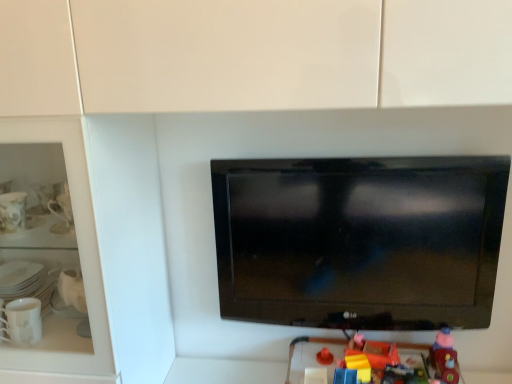
Image resolution: width=512 pixels, height=384 pixels. Describe the element at coordinates (444, 357) in the screenshot. I see `matte plastic toy at lower right, which is counted as the first toy, starting from the right` at that location.

At what (x,y) coordinates should I click in order to perform the action: click on black glossy tv at center. Please return your answer as a coordinate pair (x, y). Image resolution: width=512 pixels, height=384 pixels. Looking at the image, I should click on (360, 240).

From a real-world perspective, is matte plastic toy at lower right, the third toy in the left-to-right sequence, physically located above or below black glossy tv at center?

matte plastic toy at lower right, the third toy in the left-to-right sequence, is situated lower than black glossy tv at center in the real world.

Visually, is matte plastic toy at lower right, the third toy in the left-to-right sequence, positioned to the left or to the right of black glossy tv at center?

matte plastic toy at lower right, the third toy in the left-to-right sequence, is positioned on black glossy tv at center's right side.

Is matte plastic toy at lower right, which is counted as the first toy, starting from the right, facing towards black glossy tv at center?

No.

How different are the orientations of matte plastic toy at lower right, the third toy in the left-to-right sequence, and black glossy tv at center in degrees?

They differ by 0.878 degrees in their facing directions.

Looking at this image, can you confirm if matte plastic toy at lower right, the third toy in the left-to-right sequence, is thinner than rubberized plastic toy at lower right, acting as the 3th toy starting from the right?

Indeed, matte plastic toy at lower right, the third toy in the left-to-right sequence, has a lesser width compared to rubberized plastic toy at lower right, acting as the 3th toy starting from the right.

Is rubberized plastic toy at lower right, placed as the 1th toy when sorted from left to right, surrounded by matte plastic toy at lower right, the third toy in the left-to-right sequence?

No, rubberized plastic toy at lower right, placed as the 1th toy when sorted from left to right, is not a part of matte plastic toy at lower right, the third toy in the left-to-right sequence.

Who is bigger, matte plastic toy at lower right, which is counted as the first toy, starting from the right, or rubberized plastic toy at lower right, placed as the 1th toy when sorted from left to right?

rubberized plastic toy at lower right, placed as the 1th toy when sorted from left to right.

Locate an element on the screen. The height and width of the screenshot is (384, 512). television that is on the left side of rubberized plastic toy at lower right, placed as the 1th toy when sorted from left to right is located at coordinates (360, 240).

Which of these two, rubberized plastic toy at lower right, placed as the 1th toy when sorted from left to right, or black glossy tv at center, is smaller?

rubberized plastic toy at lower right, placed as the 1th toy when sorted from left to right.

Can you confirm if rubberized plastic toy at lower right, acting as the 3th toy starting from the right, is thinner than black glossy tv at center?

No, rubberized plastic toy at lower right, acting as the 3th toy starting from the right, is not thinner than black glossy tv at center.

Between rubberized plastic toy at lower right, placed as the 1th toy when sorted from left to right, and black glossy tv at center, which one has less height?

With less height is rubberized plastic toy at lower right, placed as the 1th toy when sorted from left to right.

Could you tell me if black glossy tv at center is turned towards rubberized plastic toy at lower right, acting as the 3th toy starting from the right?

No, black glossy tv at center does not turn towards rubberized plastic toy at lower right, acting as the 3th toy starting from the right.

Considering the relative sizes of black glossy tv at center and rubberized plastic toy at lower right, placed as the 1th toy when sorted from left to right, in the image provided, is black glossy tv at center taller than rubberized plastic toy at lower right, placed as the 1th toy when sorted from left to right,?

Yes, black glossy tv at center is taller than rubberized plastic toy at lower right, placed as the 1th toy when sorted from left to right.

Image resolution: width=512 pixels, height=384 pixels. Identify the location of the 3rd toy directly beneath the black glossy tv at center (from a real-world perspective). (387, 359).

Looking at this image, considering the relative positions of black glossy tv at center and rubberized plastic toy at lower right, acting as the 3th toy starting from the right, in the image provided, is black glossy tv at center to the right of rubberized plastic toy at lower right, acting as the 3th toy starting from the right, from the viewer's perspective?

No.

Is point (367, 382) farther from camera compared to point (448, 334)?

No, it is not.

Can you see rubberized plastic toy at lower center, which is the second toy in left-to-right order, touching matte plastic toy at lower right, the third toy in the left-to-right sequence?

No, rubberized plastic toy at lower center, which is the second toy in left-to-right order, is not with matte plastic toy at lower right, the third toy in the left-to-right sequence.

Is rubberized plastic toy at lower center, which is counted as the 2th toy, starting from the right, not inside matte plastic toy at lower right, which is counted as the first toy, starting from the right?

rubberized plastic toy at lower center, which is counted as the 2th toy, starting from the right, lies outside matte plastic toy at lower right, which is counted as the first toy, starting from the right,'s area.

Does rubberized plastic toy at lower center, which is the second toy in left-to-right order, lie behind matte plastic toy at lower right, which is counted as the first toy, starting from the right?

Yes, rubberized plastic toy at lower center, which is the second toy in left-to-right order, is further from the camera.

Does point (381, 353) come farther from viewer compared to point (360, 356)?

Yes, point (381, 353) is farther from viewer.

Can you confirm if rubberized plastic toy at lower center, which is counted as the 2th toy, starting from the right, is shorter than rubberized plastic toy at lower right, placed as the 1th toy when sorted from left to right?

Correct, rubberized plastic toy at lower center, which is counted as the 2th toy, starting from the right, is not as tall as rubberized plastic toy at lower right, placed as the 1th toy when sorted from left to right.

Considering the relative sizes of rubberized plastic toy at lower center, which is counted as the 2th toy, starting from the right, and rubberized plastic toy at lower right, acting as the 3th toy starting from the right, in the image provided, is rubberized plastic toy at lower center, which is counted as the 2th toy, starting from the right, thinner than rubberized plastic toy at lower right, acting as the 3th toy starting from the right,?

Indeed, rubberized plastic toy at lower center, which is counted as the 2th toy, starting from the right, has a lesser width compared to rubberized plastic toy at lower right, acting as the 3th toy starting from the right.

Is black glossy tv at center positioned far away from rubberized plastic toy at lower center, which is counted as the 2th toy, starting from the right?

black glossy tv at center is actually quite close to rubberized plastic toy at lower center, which is counted as the 2th toy, starting from the right.

Between black glossy tv at center and rubberized plastic toy at lower center, which is the second toy in left-to-right order, which one has less height?

rubberized plastic toy at lower center, which is the second toy in left-to-right order, is shorter.

Can you tell me how much black glossy tv at center and rubberized plastic toy at lower center, which is counted as the 2th toy, starting from the right, differ in facing direction?

The angular difference between black glossy tv at center and rubberized plastic toy at lower center, which is counted as the 2th toy, starting from the right, is 2.82 degrees.

Is black glossy tv at center oriented towards rubberized plastic toy at lower center, which is counted as the 2th toy, starting from the right?

No, black glossy tv at center is not facing towards rubberized plastic toy at lower center, which is counted as the 2th toy, starting from the right.

The width and height of the screenshot is (512, 384). Identify the location of television to the left of matte plastic toy at lower right, which is counted as the first toy, starting from the right. (360, 240).

Where is `toy located in front of the matte plastic toy at lower right, the third toy in the left-to-right sequence`? Image resolution: width=512 pixels, height=384 pixels. toy located in front of the matte plastic toy at lower right, the third toy in the left-to-right sequence is located at coordinates (387, 359).

Based on their spatial positions, is matte plastic toy at lower right, the third toy in the left-to-right sequence, or black glossy tv at center closer to rubberized plastic toy at lower right, placed as the 1th toy when sorted from left to right?

Based on the image, matte plastic toy at lower right, the third toy in the left-to-right sequence, appears to be nearer to rubberized plastic toy at lower right, placed as the 1th toy when sorted from left to right.

When comparing their distances from rubberized plastic toy at lower center, which is counted as the 2th toy, starting from the right, does black glossy tv at center or matte plastic toy at lower right, the third toy in the left-to-right sequence, seem further?

black glossy tv at center is further to rubberized plastic toy at lower center, which is counted as the 2th toy, starting from the right.

Considering their positions, is black glossy tv at center positioned closer to rubberized plastic toy at lower center, which is the second toy in left-to-right order, than rubberized plastic toy at lower right, placed as the 1th toy when sorted from left to right?

rubberized plastic toy at lower right, placed as the 1th toy when sorted from left to right, is closer to rubberized plastic toy at lower center, which is the second toy in left-to-right order.

Which object lies further to the anchor point rubberized plastic toy at lower right, placed as the 1th toy when sorted from left to right, rubberized plastic toy at lower center, which is counted as the 2th toy, starting from the right, or matte plastic toy at lower right, the third toy in the left-to-right sequence?

matte plastic toy at lower right, the third toy in the left-to-right sequence.

Which object lies further to the anchor point matte plastic toy at lower right, which is counted as the first toy, starting from the right, black glossy tv at center or rubberized plastic toy at lower right, placed as the 1th toy when sorted from left to right?

black glossy tv at center.

Based on the photo, when comparing their distances from matte plastic toy at lower right, which is counted as the first toy, starting from the right, does rubberized plastic toy at lower right, acting as the 3th toy starting from the right, or black glossy tv at center seem closer?

Among the two, rubberized plastic toy at lower right, acting as the 3th toy starting from the right, is located nearer to matte plastic toy at lower right, which is counted as the first toy, starting from the right.

Looking at the image, which one is located further to matte plastic toy at lower right, the third toy in the left-to-right sequence, rubberized plastic toy at lower right, acting as the 3th toy starting from the right, or rubberized plastic toy at lower center, which is counted as the 2th toy, starting from the right?

rubberized plastic toy at lower center, which is counted as the 2th toy, starting from the right.

Considering their positions, is matte plastic toy at lower right, which is counted as the first toy, starting from the right, positioned closer to rubberized plastic toy at lower center, which is the second toy in left-to-right order, than rubberized plastic toy at lower right, acting as the 3th toy starting from the right?

rubberized plastic toy at lower right, acting as the 3th toy starting from the right, is closer to rubberized plastic toy at lower center, which is the second toy in left-to-right order.

Identify the location of toy located between rubberized plastic toy at lower right, placed as the 1th toy when sorted from left to right, and matte plastic toy at lower right, the third toy in the left-to-right sequence, in the left-right direction. The width and height of the screenshot is (512, 384). (369, 356).

The height and width of the screenshot is (384, 512). What are the coordinates of `toy between black glossy tv at center and rubberized plastic toy at lower center, which is the second toy in left-to-right order, in the vertical direction` in the screenshot? It's located at (444, 357).